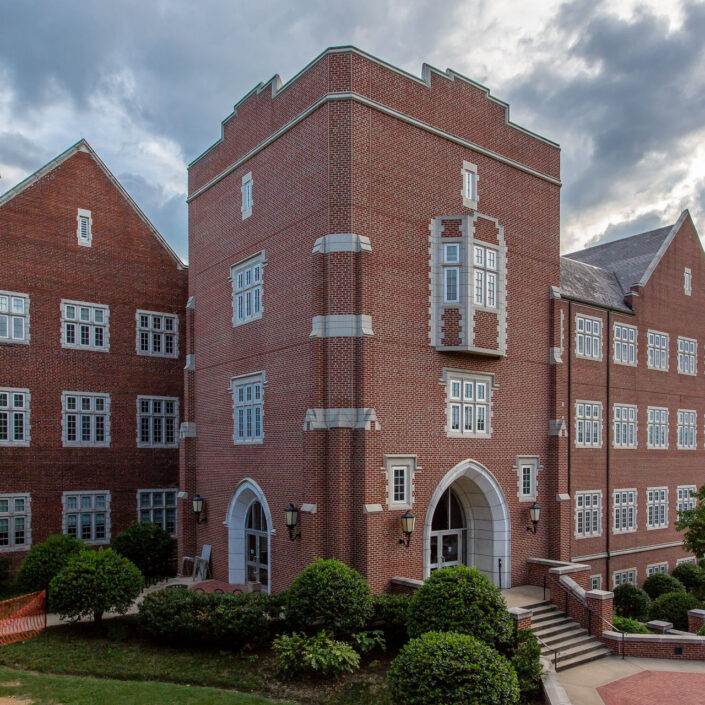
The width and height of the screenshot is (705, 705). I want to click on mounted lights, so click(405, 527), click(537, 521), click(293, 521), click(197, 503).